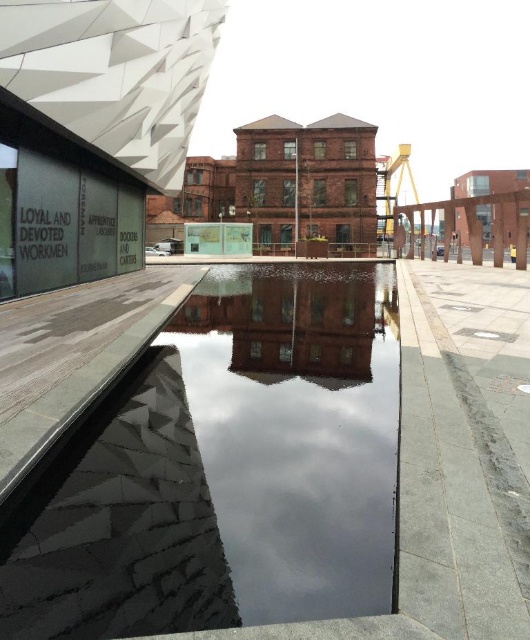
What is the exact coordinate of the transparent glass water at center?

The transparent glass water at center is located at point (296, 432).

Consider the image. You are a maintenance worker needing to clean both the transparent glass water at center and the smooth brick building at center. You have a 1.5 meter long pole. Can you reach both objects from your current position without moving closer?

The distance between the transparent glass water at center and the smooth brick building at center is 1.20 meters. Since your pole is 1.5 meters long, which is longer than the distance between them, you can reach both objects without moving closer.

You are an architect analyzing the layout of this urban space. Given the presence of transparent glass water at center and smooth brick building at center, which object takes up more area in the image?

The smooth brick building at center occupies more space than the transparent glass water at center, as stated in the description.